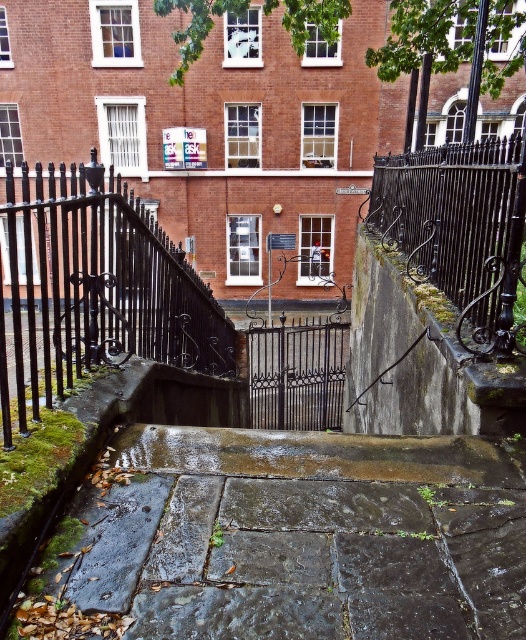
Is wet stone pavement at center below black wrought iron fence at right?

Yes, wet stone pavement at center is below black wrought iron fence at right.

Is point (169, 435) farther from viewer compared to point (460, 202)?

No.

What are the coordinates of `wet stone pavement at center` in the screenshot? It's located at (299, 536).

Can you confirm if wet stone pavement at center is thinner than black wrought iron fence at center?

Yes, wet stone pavement at center is thinner than black wrought iron fence at center.

Is point (370, 499) in front of point (28, 228)?

Yes, it is.

I want to click on wet stone pavement at center, so click(x=299, y=536).

Who is shorter, black wrought iron fence at center or black wrought iron fence at right?

black wrought iron fence at right

Image resolution: width=526 pixels, height=640 pixels. Describe the element at coordinates (93, 291) in the screenshot. I see `black wrought iron fence at center` at that location.

Is point (92, 257) farther from camera compared to point (372, 193)?

No.

At what (x,y) coordinates should I click in order to perform the action: click on black wrought iron fence at center. Please return your answer as a coordinate pair (x, y). Image resolution: width=526 pixels, height=640 pixels. Looking at the image, I should click on (93, 291).